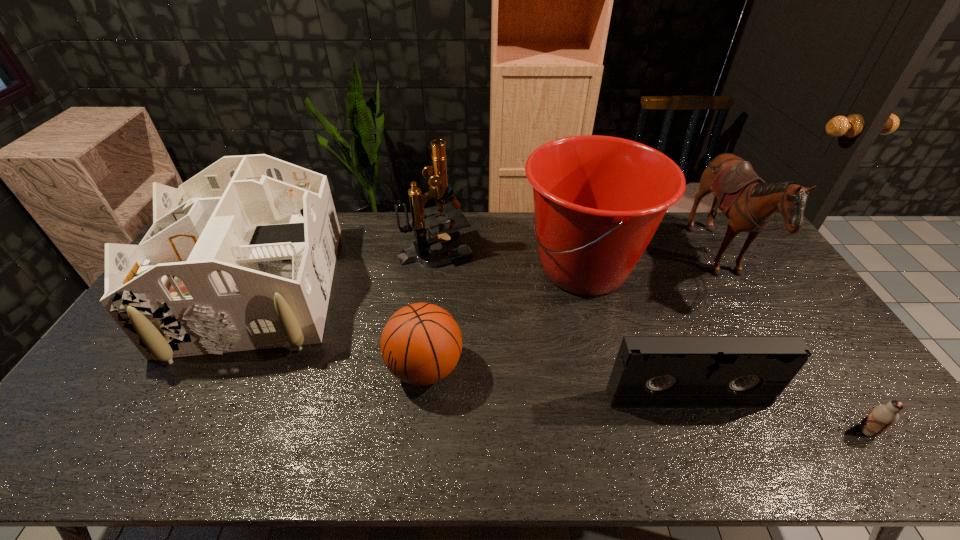
This screenshot has height=540, width=960. Find the location of `the sixth object from left to right`. the sixth object from left to right is located at coordinates (749, 203).

The height and width of the screenshot is (540, 960). I want to click on microscope, so click(423, 219).

Where is `bucket`? The image size is (960, 540). bucket is located at coordinates (598, 200).

Find the location of `the leftmost object`. the leftmost object is located at coordinates (241, 256).

I want to click on dollhouse, so click(x=241, y=256).

What are the coordinates of `videotape` in the screenshot? It's located at (649, 371).

I want to click on basketball, so click(x=421, y=343).

Locate an element on the screen. the shortest object is located at coordinates (882, 417).

Image resolution: width=960 pixels, height=540 pixels. Identify the location of chocolate milk. (882, 417).

Identify the location of free location located 0.060m on the back of the saddle. (683, 261).